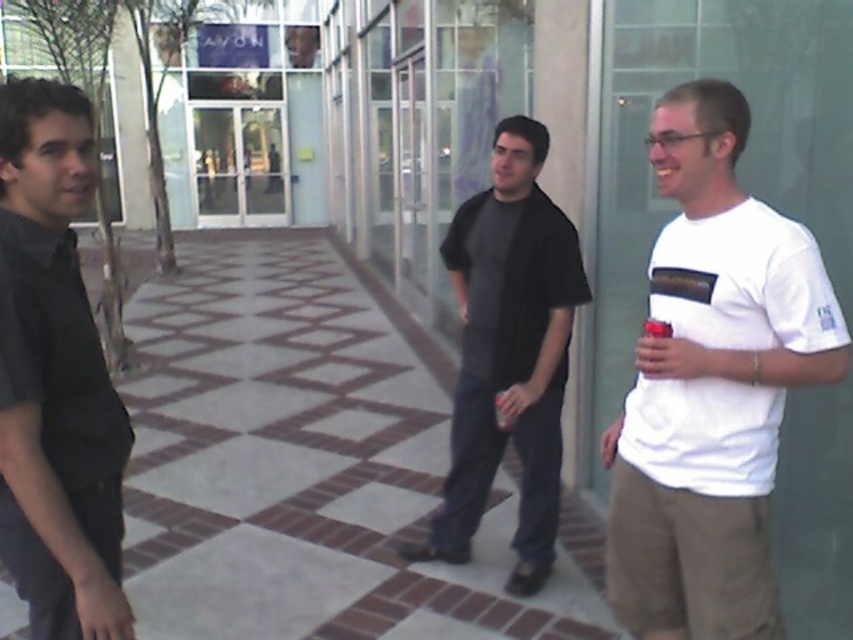
Question: Which point is closer to the camera?

Choices:
 (A) white matte t-shirt at right
 (B) matte black shirt at left

Answer: (B)

Question: Does checkerboard tile pavement at center appear on the right side of dark gray shirt at center?

Choices:
 (A) yes
 (B) no

Answer: (B)

Question: Which of these objects is positioned closest to the dark gray shirt at center?

Choices:
 (A) checkerboard tile pavement at center
 (B) matte black shirt at left
 (C) white matte t-shirt at right

Answer: (C)

Question: Which point is closer to the camera?

Choices:
 (A) matte black shirt at left
 (B) checkerboard tile pavement at center
 (C) dark gray shirt at center
 (D) white matte t-shirt at right

Answer: (A)

Question: Does checkerboard tile pavement at center have a smaller size compared to white matte t-shirt at right?

Choices:
 (A) yes
 (B) no

Answer: (B)

Question: Can you confirm if matte black shirt at left is bigger than dark gray shirt at center?

Choices:
 (A) no
 (B) yes

Answer: (A)